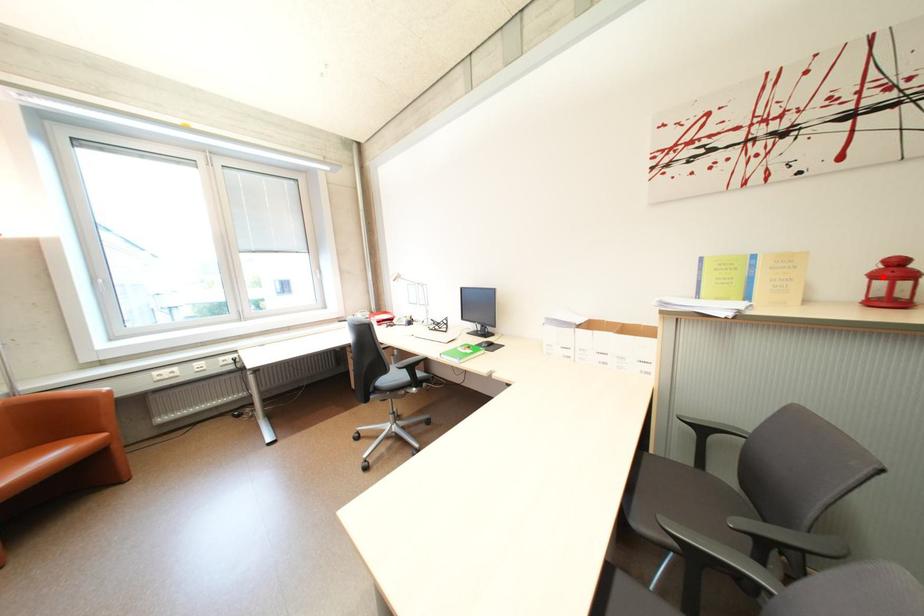
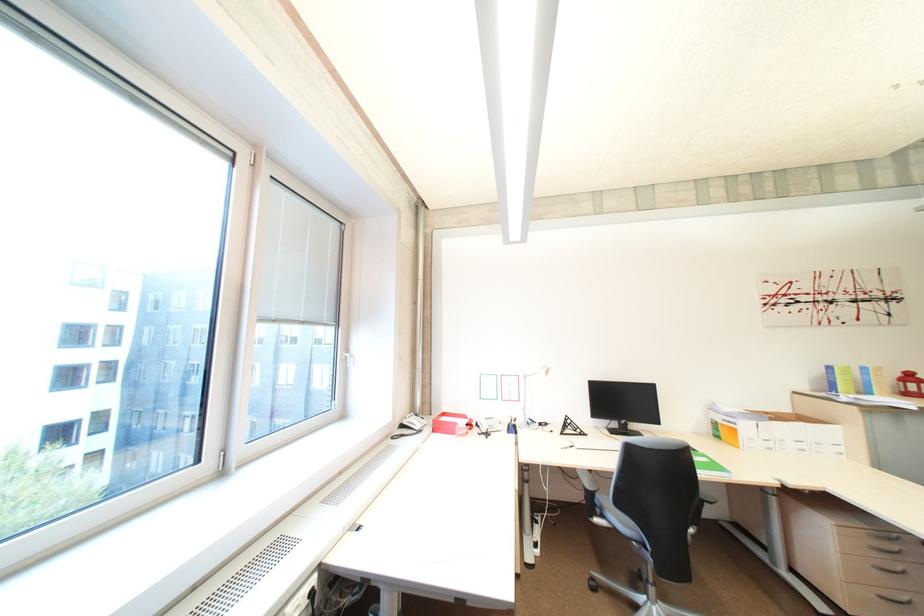
Where in the second image is the point corresponding to the highlighted location from the first image?

(913, 382)